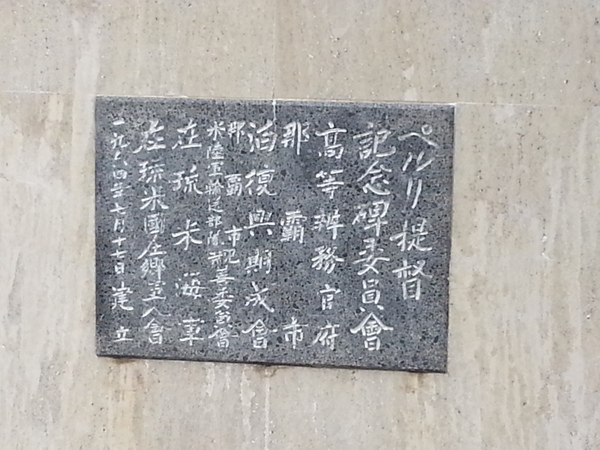
I want to click on grey and black plaque, so click(424, 342).